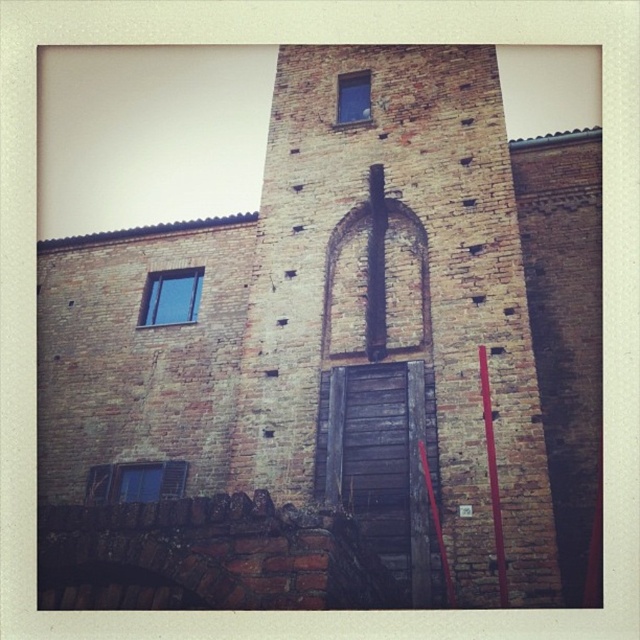
Question: Which object is closer to the camera taking this photo?

Choices:
 (A) wooden window frame at lower left
 (B) clear glass window at upper left
 (C) blue glass window at upper center

Answer: (A)

Question: Can you confirm if clear glass window at upper left is bigger than blue glass window at upper center?

Choices:
 (A) yes
 (B) no

Answer: (A)

Question: Based on their relative distances, which object is farther from the blue glass window at upper center?

Choices:
 (A) clear glass window at upper left
 (B) wooden window frame at lower left

Answer: (B)

Question: Does wooden window frame at lower left appear over blue glass window at upper center?

Choices:
 (A) yes
 (B) no

Answer: (B)

Question: Is clear glass window at upper left closer to camera compared to blue glass window at upper center?

Choices:
 (A) yes
 (B) no

Answer: (B)

Question: Which object is the closest to the clear glass window at upper left?

Choices:
 (A) wooden window frame at lower left
 (B) blue glass window at upper center

Answer: (A)